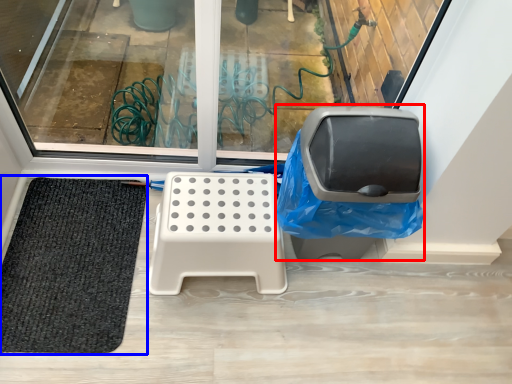
Question: Among these objects, which one is nearest to the camera, swivel chair (highlighted by a red box) or mat (highlighted by a blue box)?

Choices:
 (A) swivel chair
 (B) mat

Answer: (A)